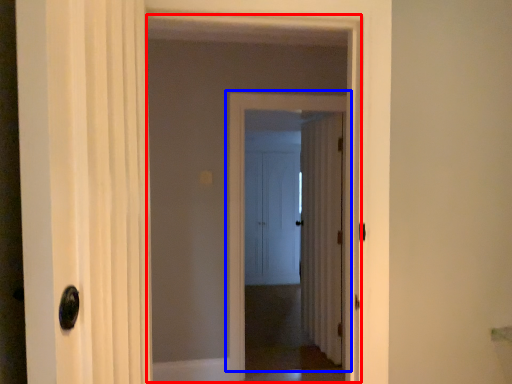
Question: Which of the following is the farthest to the observer, elevator (highlighted by a red box) or door (highlighted by a blue box)?

Choices:
 (A) elevator
 (B) door

Answer: (B)